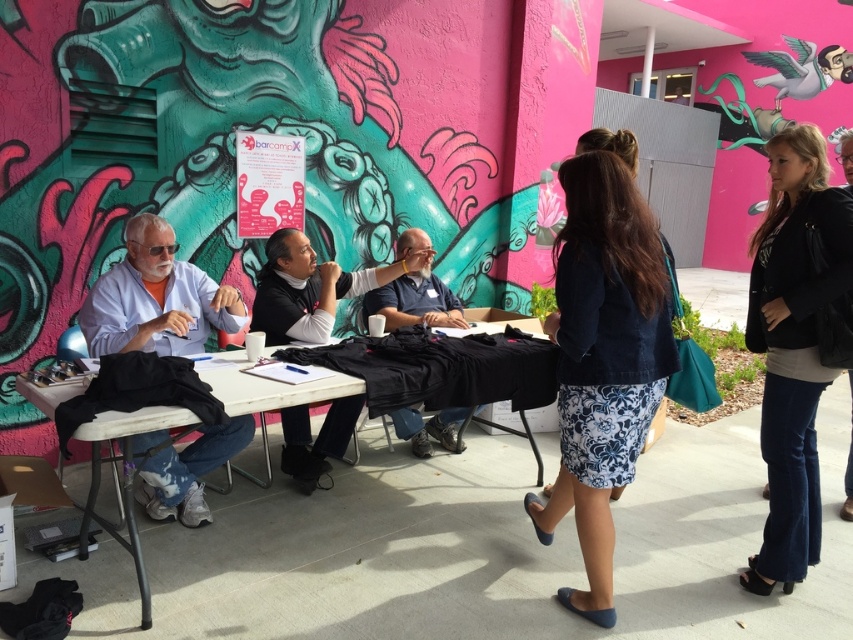
Question: Which point is closer to the camera?

Choices:
 (A) (802, 260)
 (B) (100, 289)
 (C) (424, 445)
 (D) (347, 390)

Answer: (A)

Question: Which point appears farthest from the camera in this image?

Choices:
 (A) (448, 435)
 (B) (212, 312)
 (C) (178, 408)
 (D) (747, 310)

Answer: (A)

Question: Among these objects, which one is farthest from the camera?

Choices:
 (A) black leather jacket at lower right
 (B) matte blue shirt at center
 (C) light blue shirt at left
 (D) blue floral skirt at center

Answer: (B)

Question: Does black leather jacket at lower right have a lesser width compared to white wood table at lower left?

Choices:
 (A) no
 (B) yes

Answer: (B)

Question: Can you confirm if blue floral skirt at center is positioned to the right of black leather jacket at lower right?

Choices:
 (A) no
 (B) yes

Answer: (A)

Question: Is light blue shirt at left closer to the viewer compared to black matte shirt at center?

Choices:
 (A) no
 (B) yes

Answer: (B)